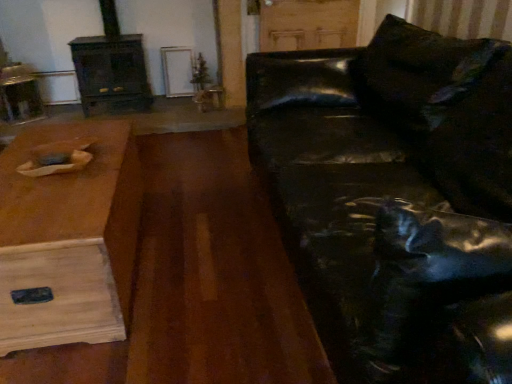
Where is `empty space that is ontop of wooden table at left (from a real-world perspective)`? empty space that is ontop of wooden table at left (from a real-world perspective) is located at coordinates (70, 187).